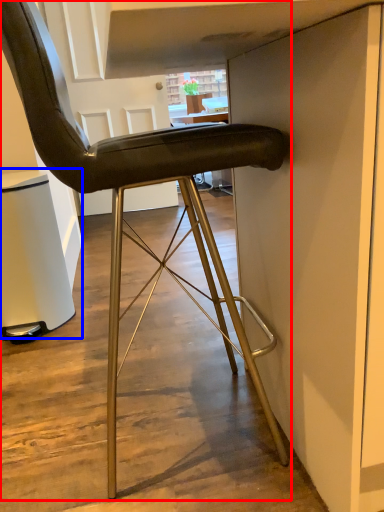
Question: Which point is closer to the camera, chair (highlighted by a red box) or cabinetry (highlighted by a blue box)?

Choices:
 (A) chair
 (B) cabinetry

Answer: (A)